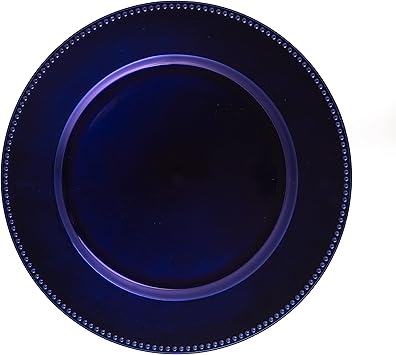
Identify the location of raised dots on charger plate. (102, 331), (90, 325), (337, 121).